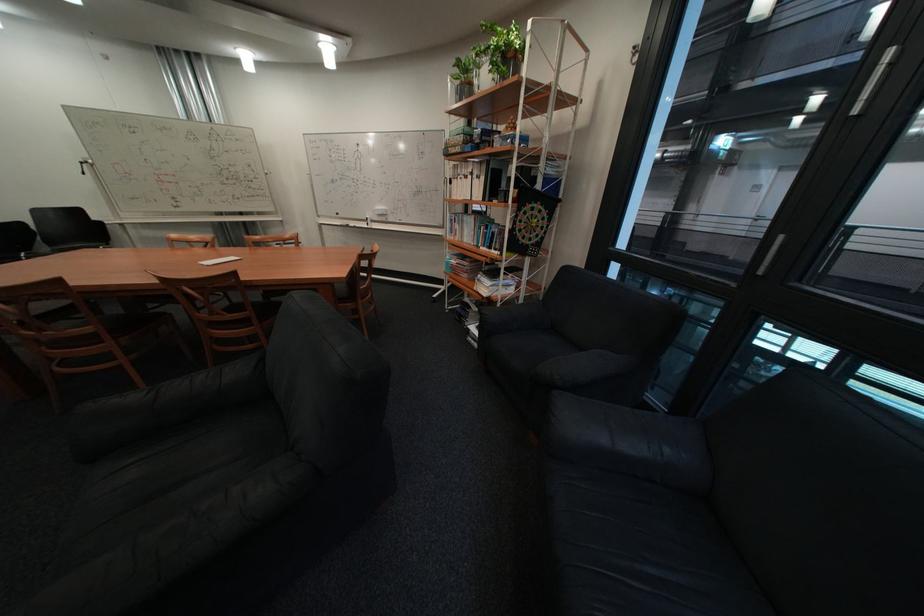
Find where to pull the silver window handle. Please return your answer as a coordinate pair (x, y).

(772, 251)